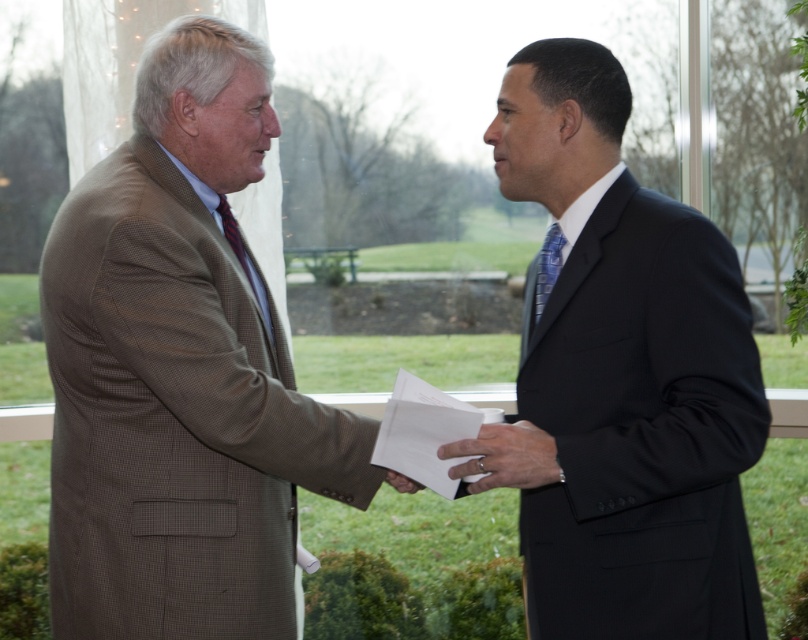
Question: Which of the following is the farthest from the observer?

Choices:
 (A) black pinstripe suit at center
 (B) white paper at center
 (C) matte black hand at center

Answer: (B)

Question: Estimate the real-world distances between objects in this image. Which object is farther from the matte black hand at center?

Choices:
 (A) black pinstripe suit at center
 (B) brown textured suit at left
 (C) white paper at center

Answer: (B)

Question: Can you confirm if black pinstripe suit at center is smaller than matte black hand at center?

Choices:
 (A) yes
 (B) no

Answer: (B)

Question: Estimate the real-world distances between objects in this image. Which object is closer to the matte black hand at center?

Choices:
 (A) black pinstripe suit at center
 (B) white paper at center

Answer: (B)

Question: Can you confirm if brown textured suit at left is wider than black pinstripe suit at center?

Choices:
 (A) no
 (B) yes

Answer: (B)

Question: Can you confirm if brown textured suit at left is thinner than matte black hand at center?

Choices:
 (A) no
 (B) yes

Answer: (A)